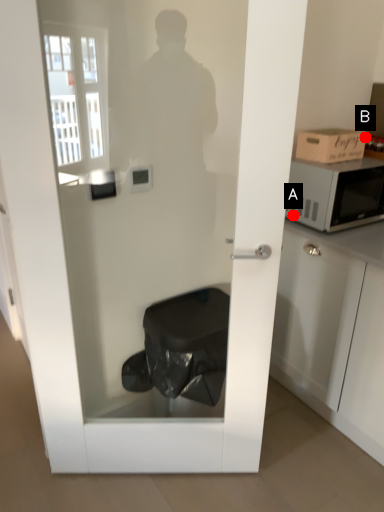
Question: Two points are circled on the image, labeled by A and B beside each circle. Which point is further to the camera?

Choices:
 (A) A is further
 (B) B is further

Answer: (B)